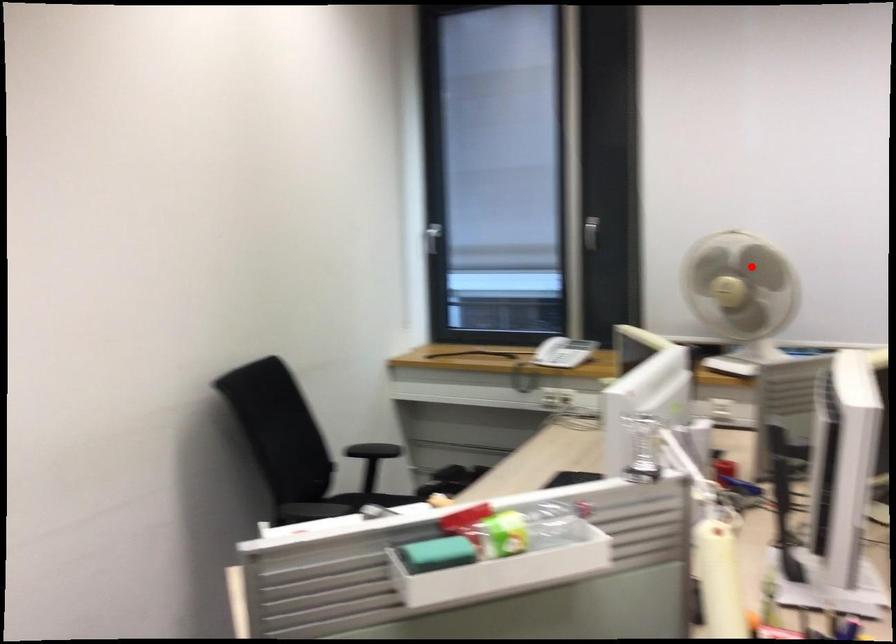
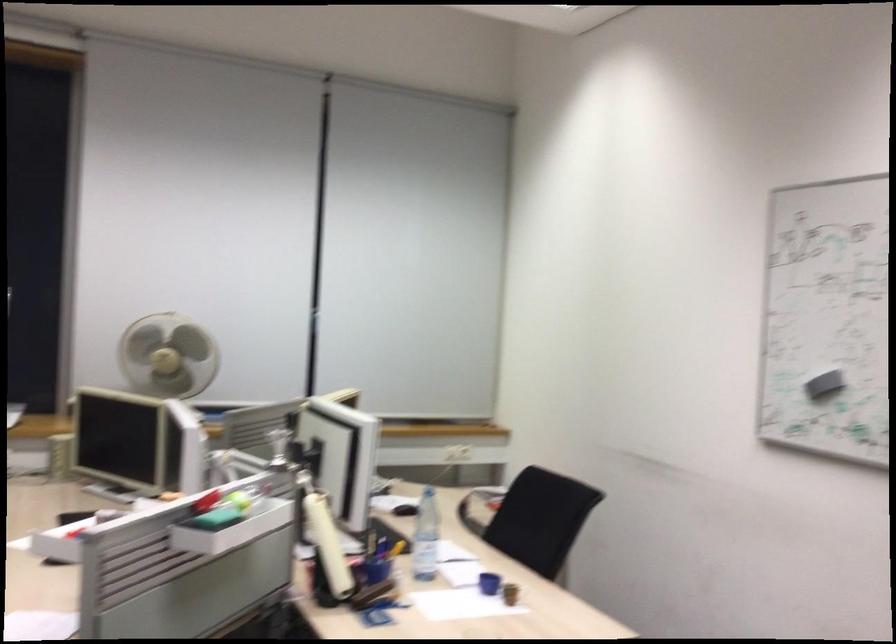
Find the pixel in the second image that matches the highlighted location in the first image.

(168, 355)